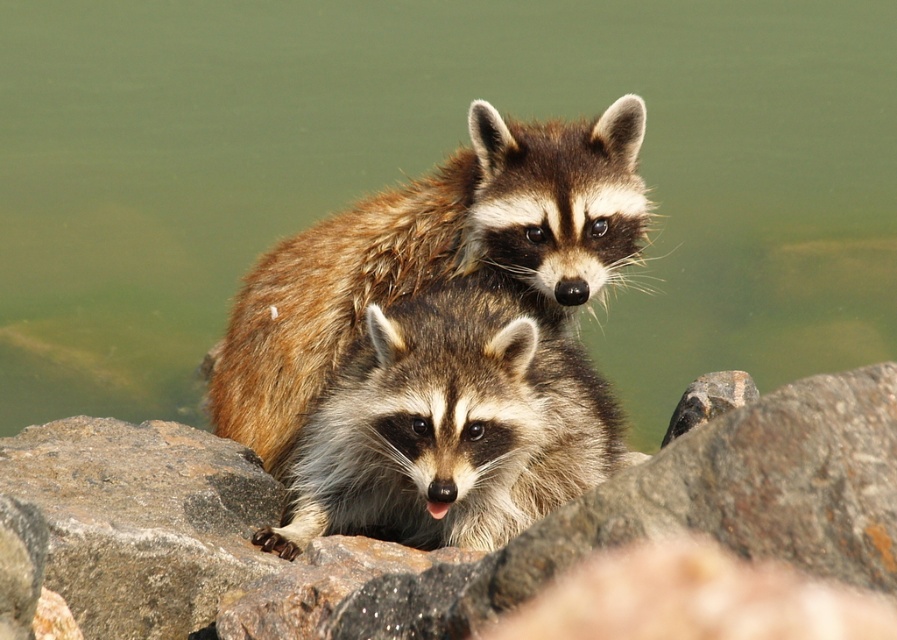
Is fuzzy brown raccoon at center taller than brown furry raccoon at center?

No, fuzzy brown raccoon at center is not taller than brown furry raccoon at center.

Who is more distant from viewer, (485, 536) or (386, 211)?

The point (386, 211) is behind.

Identify the location of fuzzy brown raccoon at center. The width and height of the screenshot is (897, 640). (450, 426).

The height and width of the screenshot is (640, 897). Identify the location of brown rough rock at center. (710, 502).

Does brown rough rock at center appear under fuzzy brown raccoon at center?

Correct, brown rough rock at center is located below fuzzy brown raccoon at center.

Does point (746, 520) come behind point (456, 483)?

No, it is not.

Where is `brown rough rock at center`? Image resolution: width=897 pixels, height=640 pixels. brown rough rock at center is located at coordinates (710, 502).

Describe the element at coordinates (710, 502) in the screenshot. I see `brown rough rock at center` at that location.

Can you confirm if brown rough rock at center is positioned to the right of brown furry raccoon at center?

In fact, brown rough rock at center is to the left of brown furry raccoon at center.

Which is in front, point (103, 502) or point (555, 292)?

Point (103, 502)

This screenshot has height=640, width=897. I want to click on brown rough rock at center, so click(x=710, y=502).